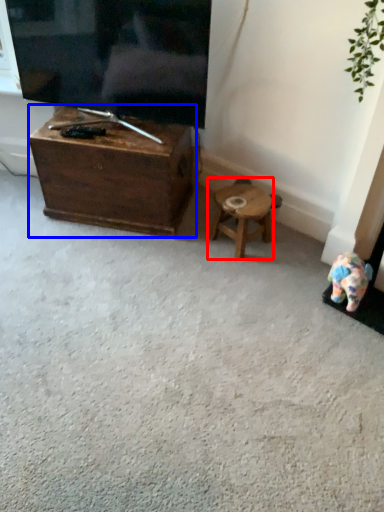
Question: Which object appears farthest to the camera in this image, stool (highlighted by a red box) or table (highlighted by a blue box)?

Choices:
 (A) stool
 (B) table

Answer: (A)